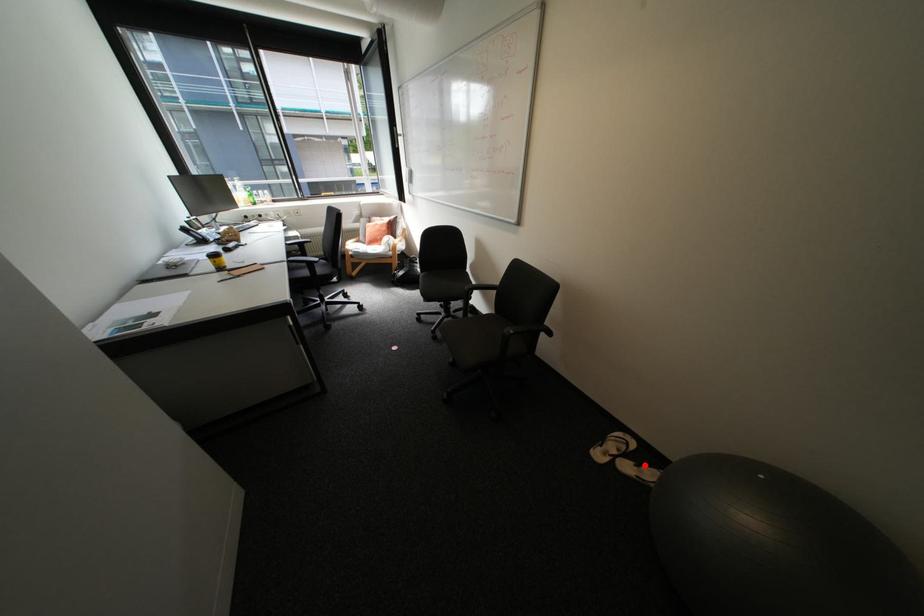
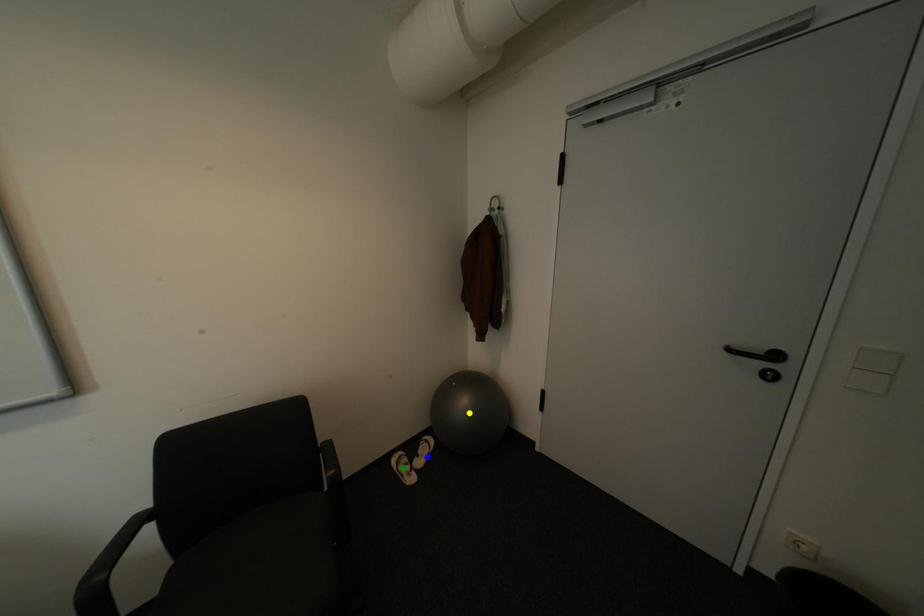
Question: I am providing you with two images of the same scene from different viewpoints. A red point is marked on the first image. You are given multiple points on the second image. Which point in image 2 is actually the same real-world point as the red point in image 1?

Choices:
 (A) green point
 (B) yellow point
 (C) blue point

Answer: (C)